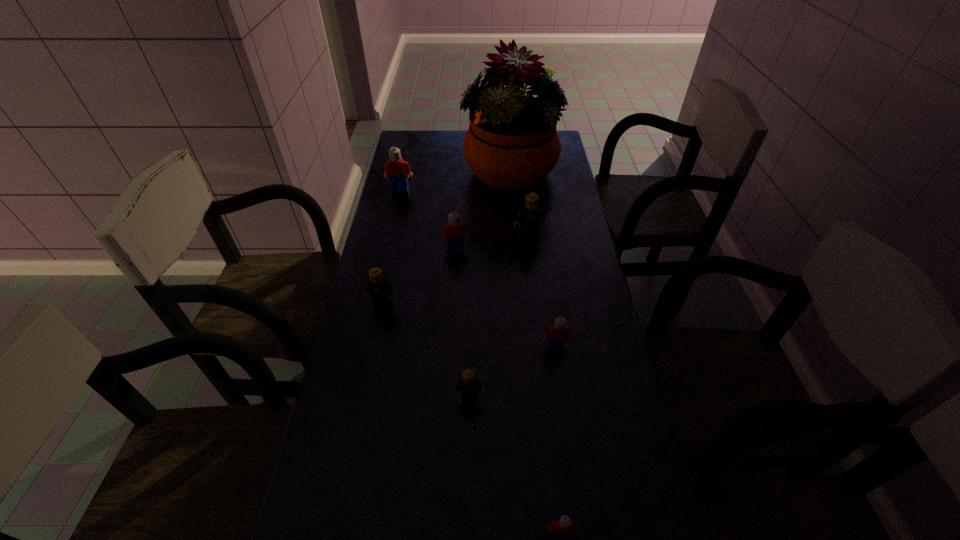
Select which Lego is the sixth closest to the sixth nearest Lego. Please provide its 2D coordinates. Your answer should be formatted as a tuple, i.e. [(x, y)], where the tuple contains the x and y coordinates of a point satisfying the conditions above.

[(564, 526)]

Where is `tan Lego that is the second closest to the third smallest white Lego`? The height and width of the screenshot is (540, 960). tan Lego that is the second closest to the third smallest white Lego is located at coordinates (380, 289).

Point out which tan Lego is positioned as the second nearest to the second biggest white Lego. Please provide its 2D coordinates. Your answer should be formatted as a tuple, i.e. [(x, y)], where the tuple contains the x and y coordinates of a point satisfying the conditions above.

[(380, 289)]

Identify the location of white Lego that is the second closest to the third farthest object. Image resolution: width=960 pixels, height=540 pixels. (556, 335).

Locate an element on the screen. white Lego that stands as the second closest to the second tan Lego from right to left is located at coordinates (564, 526).